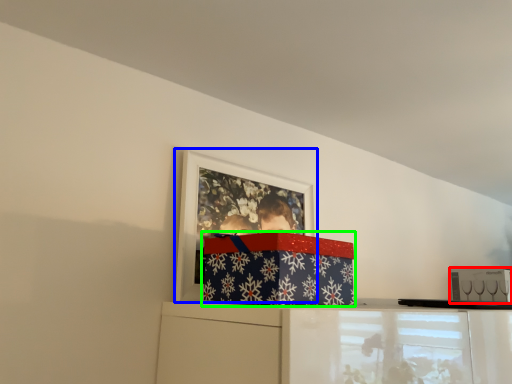
Question: Which object is positioned farthest from box (highlighted by a red box)? Select from picture frame (highlighted by a blue box) and package (highlighted by a green box).

Choices:
 (A) picture frame
 (B) package

Answer: (B)